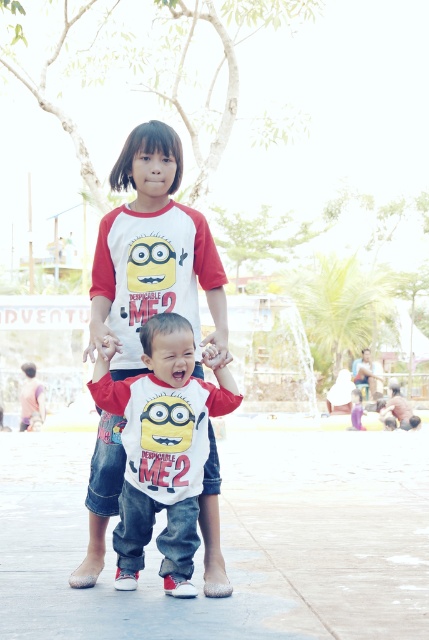
Based on the photo, you are a photographer setting up a shot of the two children. The concrete at center and the white matte shirt at center are both in your frame. Which object is taller in the image?

The white matte shirt at center is taller than the concrete at center.

Consider the image. You are a photographer trying to capture a photo of both children in the scene. If you focus on the point at point (278, 440), will the point at point (156, 483) also be in focus? Explain your reasoning.

Since point (278, 440) is further to the camera than point (156, 483), focusing on the closer point might keep both in focus depending on the depth of field. However, if the depth of field is shallow, the background point could be out of focus.